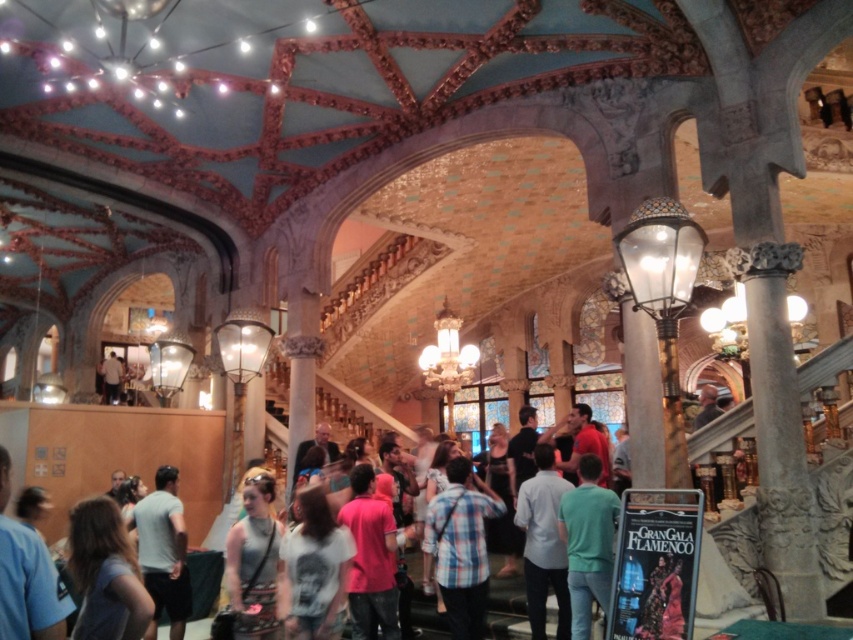
What is located at the point with coordinates (459, 547) in the image?

The plaid fabric shirt at center is located at point (459, 547).